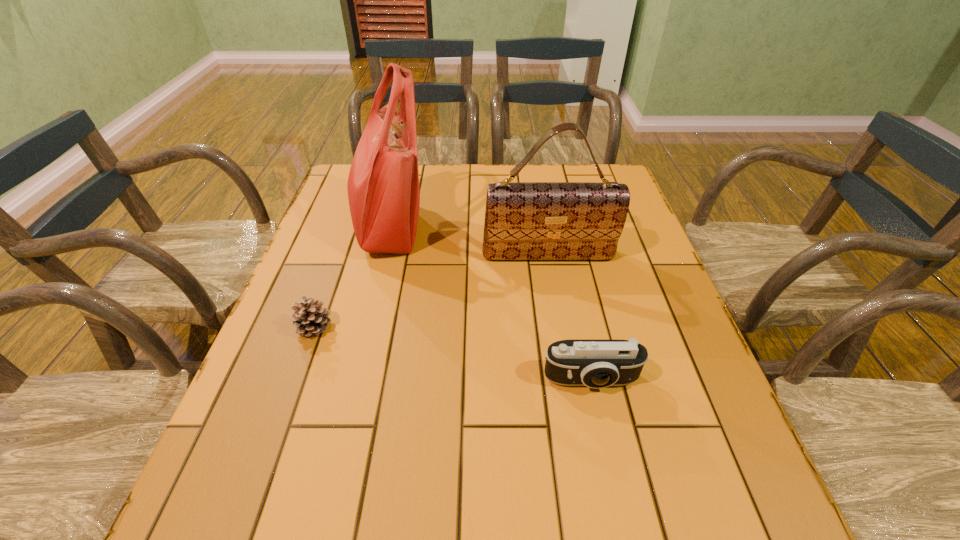
The image size is (960, 540). I want to click on free space located 0.130m on the front lens of the third tallest object, so [610, 464].

At what (x,y) coordinates should I click in order to perform the action: click on vacant space located 0.050m on the back of the shortest object. Please return your answer as a coordinate pair (x, y). This screenshot has height=540, width=960. Looking at the image, I should click on (325, 297).

Image resolution: width=960 pixels, height=540 pixels. In order to click on object present at the far edge in this screenshot , I will do `click(383, 187)`.

Locate an element on the screen. The width and height of the screenshot is (960, 540). handbag located at the left edge is located at coordinates (383, 187).

Identify the location of pinecone that is at the left edge. The height and width of the screenshot is (540, 960). (309, 318).

Where is `handbag positioned at the right edge`? This screenshot has height=540, width=960. handbag positioned at the right edge is located at coordinates click(523, 220).

You are a GUI agent. You are given a task and a screenshot of the screen. Output one action in this format:
    pyautogui.click(x=<x>, y=<y>)
    Task: Click on the camera present at the right edge
    
    Given the screenshot: What is the action you would take?
    pyautogui.click(x=597, y=364)

Find the location of `object positioned at the far left corner`. object positioned at the far left corner is located at coordinates (383, 187).

Where is `vacant region at the far edge of the desktop`? The height and width of the screenshot is (540, 960). vacant region at the far edge of the desktop is located at coordinates (495, 166).

Identify the location of vacant position at the left edge of the desktop. Image resolution: width=960 pixels, height=540 pixels. (351, 242).